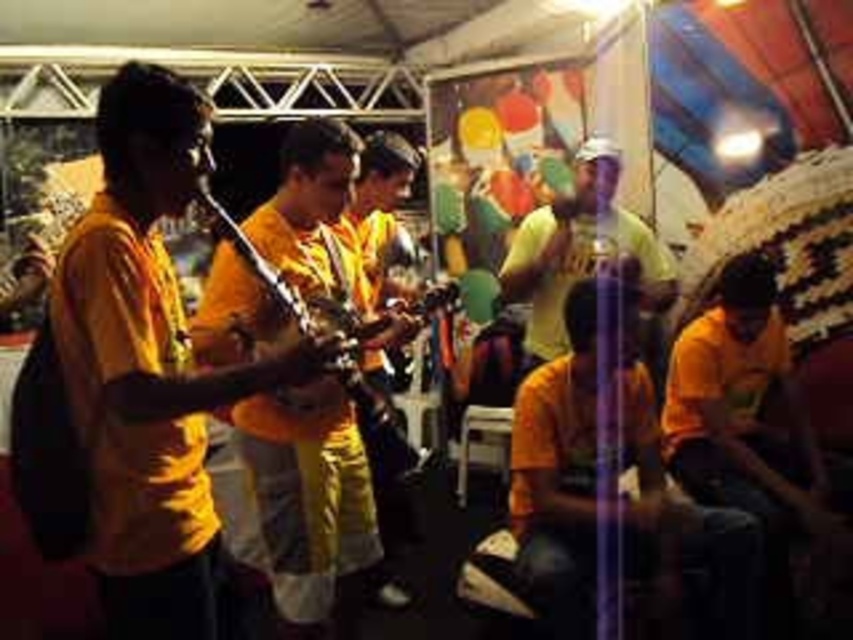
Is yellow matte shirt at left closer to camera compared to metallic gold instrument at center?

Yes, it is.

Between yellow matte shirt at left and metallic gold instrument at center, which one has more height?

Standing taller between the two is yellow matte shirt at left.

Where is `yellow matte shirt at left`? yellow matte shirt at left is located at coordinates (149, 365).

Where is `yellow matte shirt at left`? The width and height of the screenshot is (853, 640). yellow matte shirt at left is located at coordinates (149, 365).

Between yellow matte shirt at left and matte yellow shirt at center, which one is positioned higher?

matte yellow shirt at center

Is yellow matte shirt at left positioned behind matte yellow shirt at center?

No, yellow matte shirt at left is in front of matte yellow shirt at center.

The height and width of the screenshot is (640, 853). What are the coordinates of `yellow matte shirt at left` in the screenshot? It's located at (149, 365).

This screenshot has width=853, height=640. Identify the location of matte yellow shirt at center. [583, 252].

Describe the element at coordinates (583, 252) in the screenshot. I see `matte yellow shirt at center` at that location.

At what (x,y) coordinates should I click in order to perform the action: click on matte yellow shirt at center. Please return your answer as a coordinate pair (x, y). The width and height of the screenshot is (853, 640). Looking at the image, I should click on (583, 252).